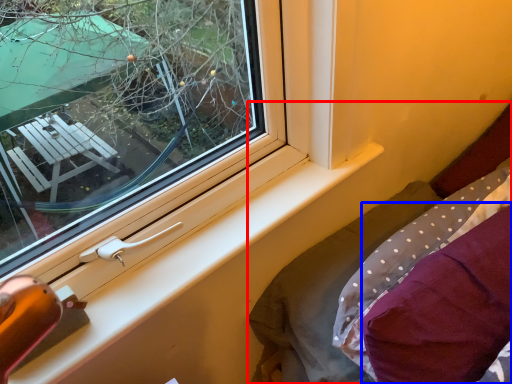
Question: Which object is closer to the camera taking this photo, bed (highlighted by a red box) or pillow (highlighted by a blue box)?

Choices:
 (A) bed
 (B) pillow

Answer: (B)